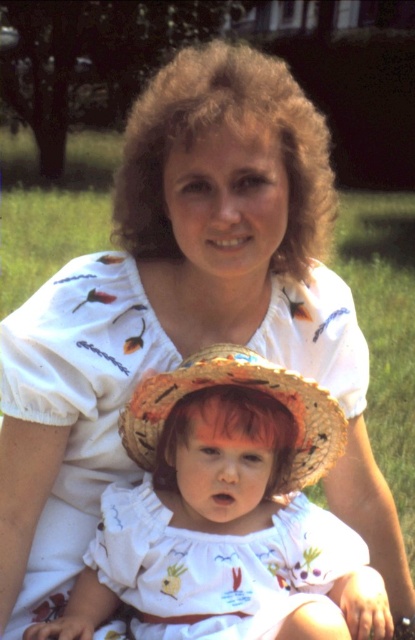
Between white cotton dress at center and natural straw hat at center, which one is positioned higher?

natural straw hat at center

Who is positioned more to the left, white cotton dress at center or natural straw hat at center?

From the viewer's perspective, natural straw hat at center appears more on the left side.

What do you see at coordinates (227, 515) in the screenshot? This screenshot has width=415, height=640. I see `white cotton dress at center` at bounding box center [227, 515].

Identify the location of white cotton dress at center. Image resolution: width=415 pixels, height=640 pixels. (227, 515).